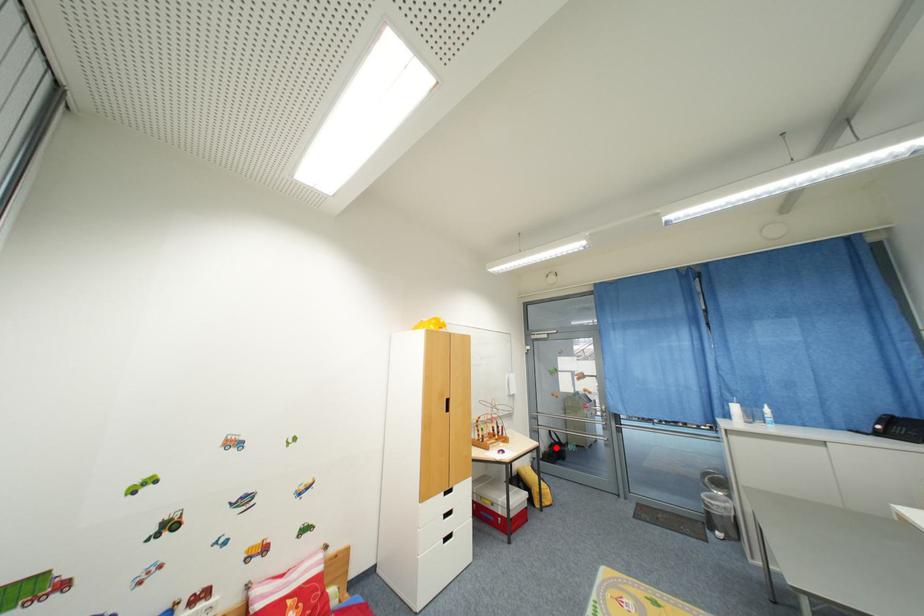
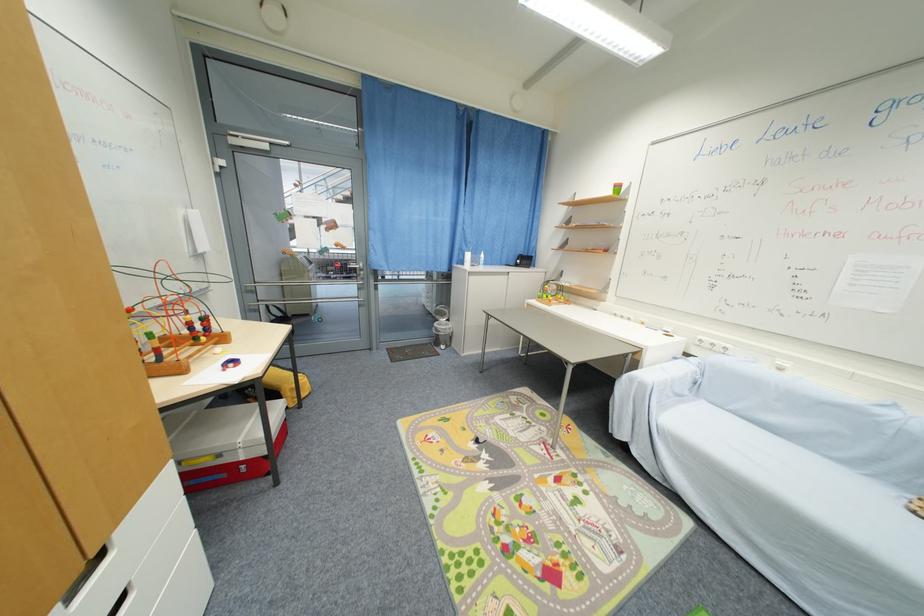
Question: I am providing you with two images of the same scene from different viewpoints. A red point is marked on the first image. Can you still see the location of the red point in image 2?

Choices:
 (A) Yes
 (B) No

Answer: (B)